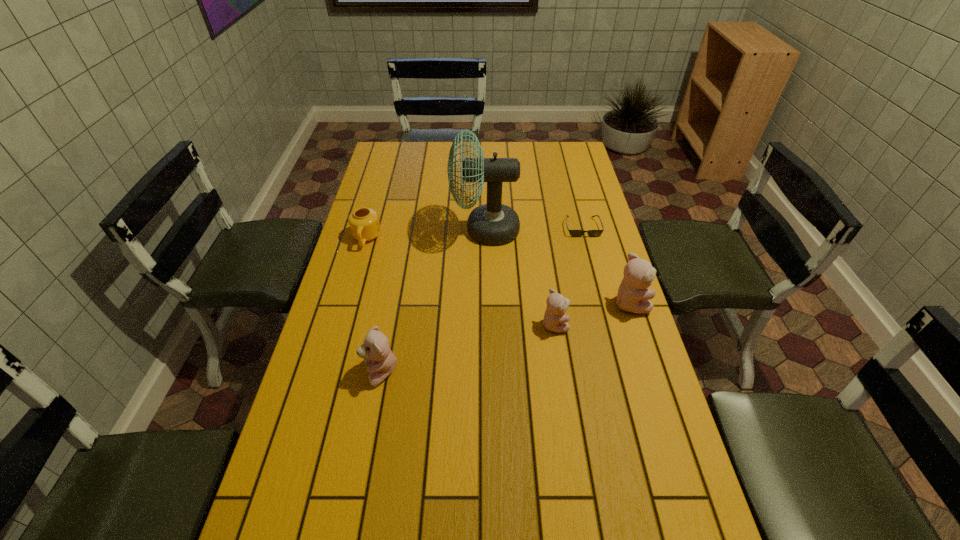
At what (x,y) coordinates should I click in order to perform the action: click on mug present at the left edge. Please return your answer as a coordinate pair (x, y). Looking at the image, I should click on (364, 224).

You are a GUI agent. You are given a task and a screenshot of the screen. Output one action in this format:
    pyautogui.click(x=<x>, y=<y>)
    Task: Click on the teddy bear situated at the right edge
    
    Given the screenshot: What is the action you would take?
    [633, 297]

Locate an element on the screen. sunglasses at the right edge is located at coordinates (575, 233).

The width and height of the screenshot is (960, 540). In the image, there is a desktop. Find the location of `vacant space at the far edge`. vacant space at the far edge is located at coordinates (531, 167).

You are a GUI agent. You are given a task and a screenshot of the screen. Output one action in this format:
    pyautogui.click(x=<x>, y=<y>)
    Task: Click on the free space at the near edge
    
    Given the screenshot: What is the action you would take?
    pyautogui.click(x=508, y=519)

Where is `free space at the left edge of the desktop`? The image size is (960, 540). free space at the left edge of the desktop is located at coordinates (369, 205).

What are the coordinates of `free space at the right edge` in the screenshot? It's located at (634, 341).

This screenshot has width=960, height=540. In the image, there is a desktop. What are the coordinates of `vacant space at the far left corner` in the screenshot? It's located at pos(391,156).

This screenshot has width=960, height=540. I want to click on vacant space that is in between the fifth tallest object and the shortest teddy bear, so click(460, 281).

Locate an element on the screen. Image resolution: width=960 pixels, height=540 pixels. vacant area that lies between the rightmost teddy bear and the leftmost object is located at coordinates (498, 271).